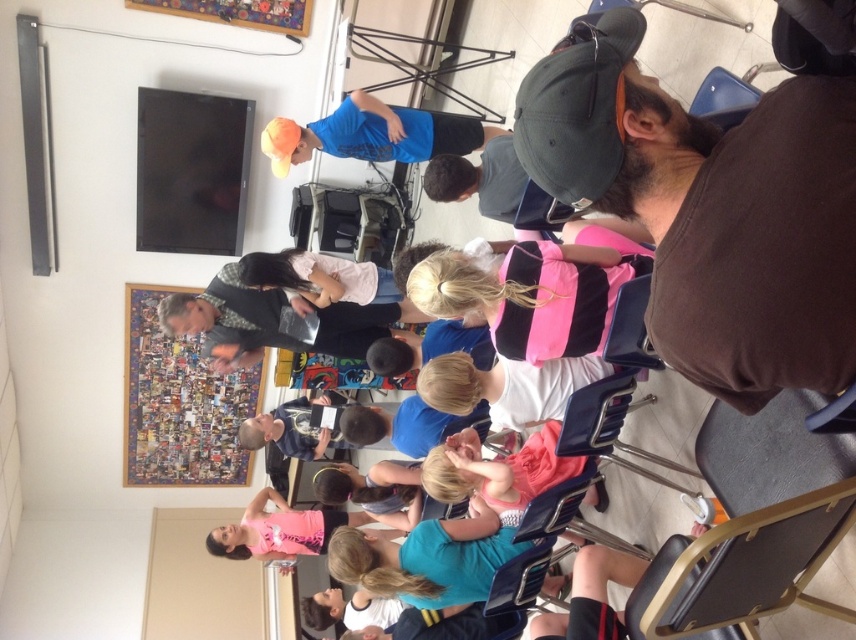
Can you confirm if brown matte shirt at upper right is bigger than pink fabric dress at center?

Actually, brown matte shirt at upper right might be smaller than pink fabric dress at center.

Which is behind, point (649, 298) or point (539, 484)?

The point (539, 484) is behind.

You are a GUI agent. You are given a task and a screenshot of the screen. Output one action in this format:
    pyautogui.click(x=<x>, y=<y>)
    Task: Click on the brown matte shirt at upper right
    This screenshot has height=640, width=856.
    Given the screenshot: What is the action you would take?
    pyautogui.click(x=711, y=209)

Does pink striped vest at center have a smaller size compared to pink fabric dress at center?

No, pink striped vest at center is not smaller than pink fabric dress at center.

Between point (485, 282) and point (443, 474), which one is positioned in front?

Positioned in front is point (485, 282).

The height and width of the screenshot is (640, 856). What are the coordinates of `pink striped vest at center` in the screenshot? It's located at (535, 291).

Between point (557, 344) and point (360, 573), which one is positioned in front?

Positioned in front is point (557, 344).

Does pink striped vest at center have a lesser height compared to blue fabric shirt at center?

No.

Does point (551, 244) lie behind point (456, 570)?

No, (551, 244) is in front of (456, 570).

Locate an element on the screen. This screenshot has width=856, height=640. pink striped vest at center is located at coordinates (535, 291).